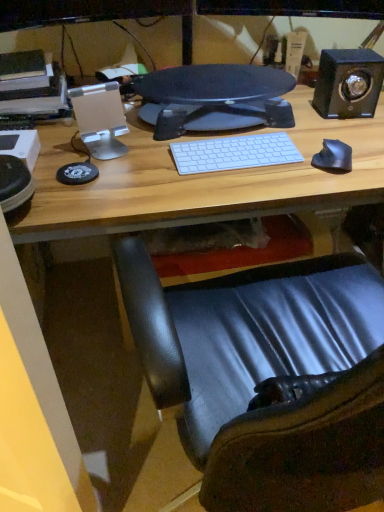
What are the coordinates of `vacant space to the left of black matte speaker at upper right` in the screenshot? It's located at (300, 114).